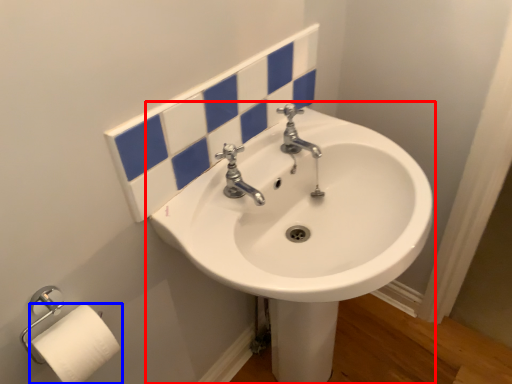
Question: Which of the following is the farthest to the observer, sink (highlighted by a red box) or toilet paper (highlighted by a blue box)?

Choices:
 (A) sink
 (B) toilet paper

Answer: (B)